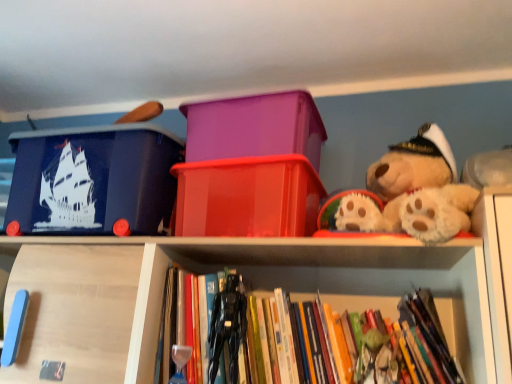
Question: Considering the relative sizes of hardcover books at center and purple plastic storage box at center, which appears as the third storage box when viewed from the left, in the image provided, is hardcover books at center shorter than purple plastic storage box at center, which appears as the third storage box when viewed from the left,?

Choices:
 (A) no
 (B) yes

Answer: (A)

Question: Is purple plastic storage box at center, marked as the first storage box in a right-to-left arrangement, completely or partially inside hardcover books at center?

Choices:
 (A) yes
 (B) no

Answer: (B)

Question: Can you confirm if hardcover books at center is positioned to the right of purple plastic storage box at center, marked as the first storage box in a right-to-left arrangement?

Choices:
 (A) no
 (B) yes

Answer: (B)

Question: Is hardcover books at center in contact with purple plastic storage box at center, which appears as the third storage box when viewed from the left?

Choices:
 (A) no
 (B) yes

Answer: (A)

Question: From a real-world perspective, is hardcover books at center located beneath purple plastic storage box at center, which appears as the third storage box when viewed from the left?

Choices:
 (A) no
 (B) yes

Answer: (B)

Question: Can you confirm if hardcover books at center is positioned to the left of purple plastic storage box at center, marked as the first storage box in a right-to-left arrangement?

Choices:
 (A) yes
 (B) no

Answer: (B)

Question: Is black plastic action figure at center to the right of matte blue plastic storage box at upper left, the 1th storage box from the left, from the viewer's perspective?

Choices:
 (A) no
 (B) yes

Answer: (B)

Question: Is black plastic action figure at center positioned behind matte blue plastic storage box at upper left, the 1th storage box from the left?

Choices:
 (A) yes
 (B) no

Answer: (B)

Question: Is black plastic action figure at center not close to matte blue plastic storage box at upper left, the third storage box in the right-to-left sequence?

Choices:
 (A) no
 (B) yes

Answer: (A)

Question: Is black plastic action figure at center with matte blue plastic storage box at upper left, the third storage box in the right-to-left sequence?

Choices:
 (A) yes
 (B) no

Answer: (B)

Question: From the image's perspective, is black plastic action figure at center over matte blue plastic storage box at upper left, the 1th storage box from the left?

Choices:
 (A) yes
 (B) no

Answer: (B)

Question: From a real-world perspective, is black plastic action figure at center below matte blue plastic storage box at upper left, the third storage box in the right-to-left sequence?

Choices:
 (A) no
 (B) yes

Answer: (B)

Question: Is black plastic action figure at center completely or partially inside translucent red plastic container at center, acting as the second storage box starting from the right?

Choices:
 (A) yes
 (B) no

Answer: (B)